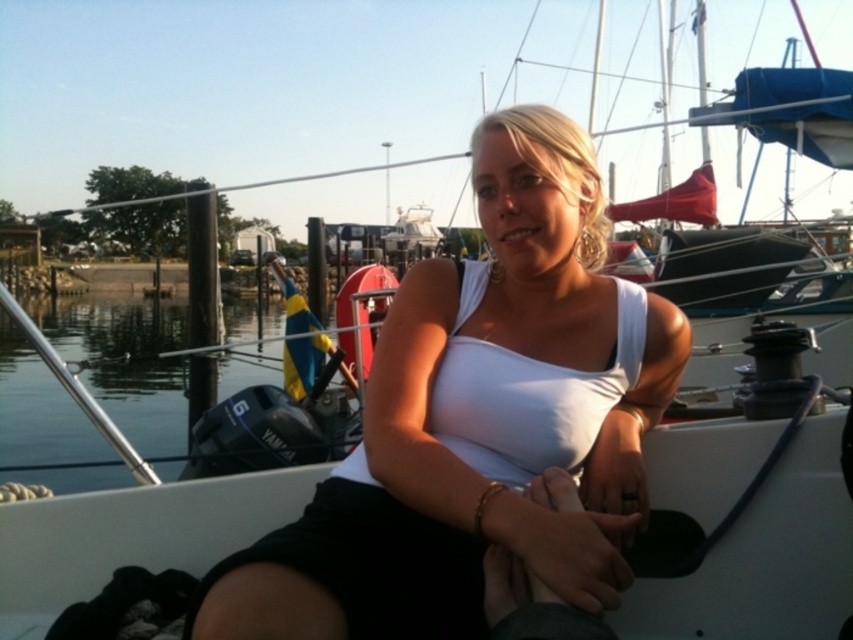
You are standing on the dock and want to know which point is closer to you. The points are point (682,324) and point (80,412). Which point is closer to you?

Point (80,412) is closer to you because it is behind point (682,324).

You are a photographer trying to capture the scene of a woman on a boat. You notice the white matte tank top at center and the clear water at lower left. Which object is positioned to the right side of the other?

The white matte tank top at center is to the right of clear water at lower left.

Based on the scene description, which object takes up more area in the image? The white matte tank top at center or the clear water at lower left?

The clear water at lower left occupies more area than the white matte tank top at center.